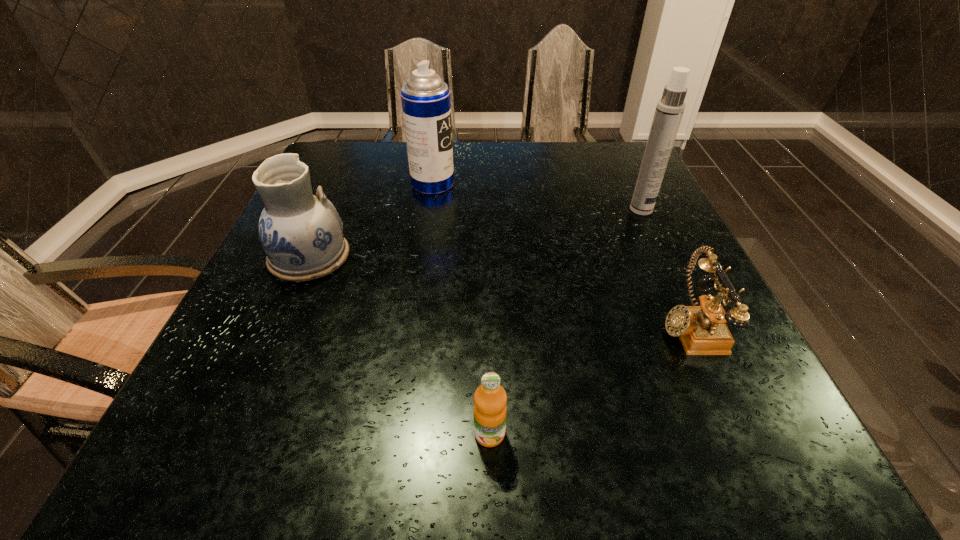
This screenshot has width=960, height=540. Find the location of `unoccupied area between the second nearest object and the orange juice`. unoccupied area between the second nearest object and the orange juice is located at coordinates (588, 379).

At what (x,y) coordinates should I click in order to perform the action: click on vacant area that lies between the farther aerosol can and the nearest object. Please return your answer as a coordinate pair (x, y). This screenshot has height=540, width=960. Looking at the image, I should click on (461, 309).

Find the location of `vacant area that lies between the telephone and the left aerosol can`. vacant area that lies between the telephone and the left aerosol can is located at coordinates (561, 254).

The image size is (960, 540). Identify the location of free space between the fourth object from right to left and the third farthest object. (371, 220).

Where is `vacant area that lies between the right aerosol can and the fourth farthest object`? vacant area that lies between the right aerosol can and the fourth farthest object is located at coordinates (664, 267).

At what (x,y) coordinates should I click in order to perform the action: click on unoccupied position between the orange juice and the pottery. Please return your answer as a coordinate pair (x, y). The height and width of the screenshot is (540, 960). Looking at the image, I should click on (399, 345).

Locate which object ranks third in proximity to the left aerosol can. Please provide its 2D coordinates. Your answer should be formatted as a tuple, i.e. [(x, y)], where the tuple contains the x and y coordinates of a point satisfying the conditions above.

[(702, 330)]

This screenshot has width=960, height=540. What are the coordinates of `the third closest object relative to the right aerosol can` in the screenshot? It's located at (490, 399).

The image size is (960, 540). What are the coordinates of `free space that satisfies the following two spatial constraints: 1. on the dial number of the second nearest object; 2. on the label of the nearest object` in the screenshot? It's located at (737, 434).

In order to click on vacant area that satisfies the following two spatial constraints: 1. on the label side of the farther aerosol can; 2. on the left side of the fourth nearest object in this screenshot , I will do `click(429, 210)`.